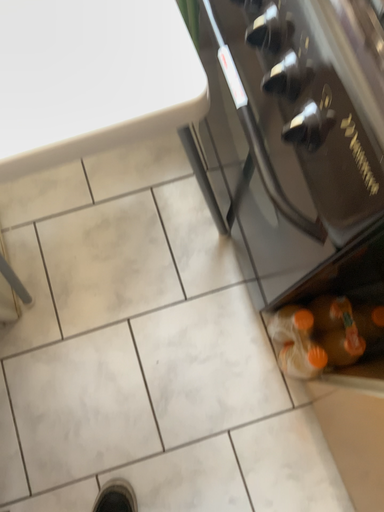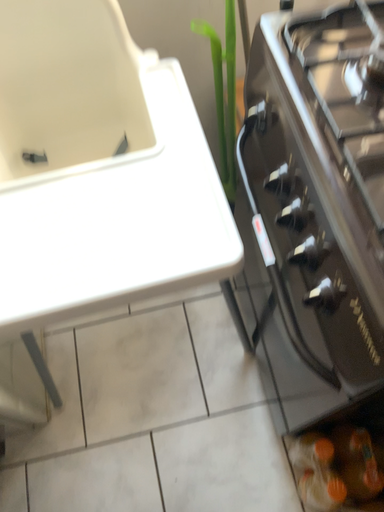
Question: How did the camera likely rotate when shooting the video?

Choices:
 (A) rotated upward
 (B) rotated downward

Answer: (A)